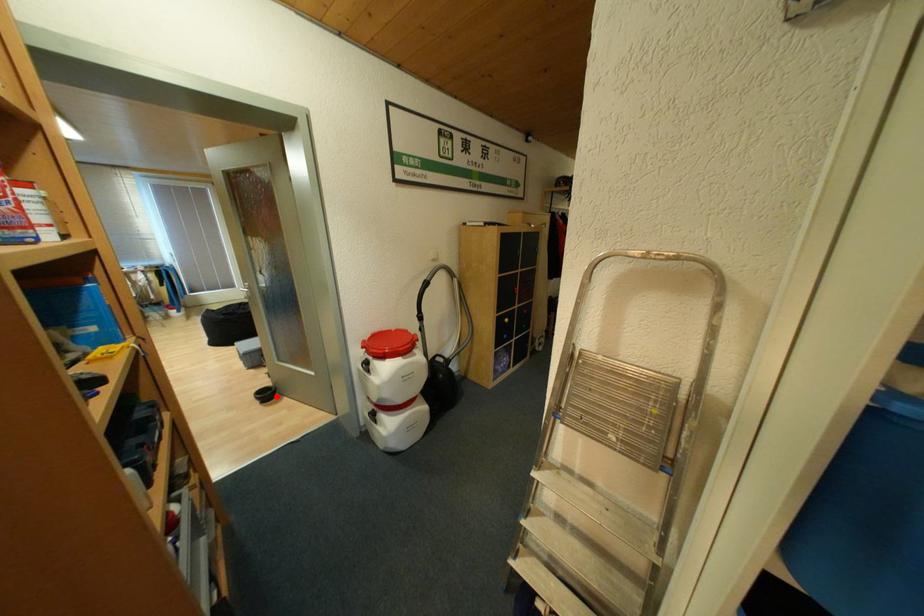
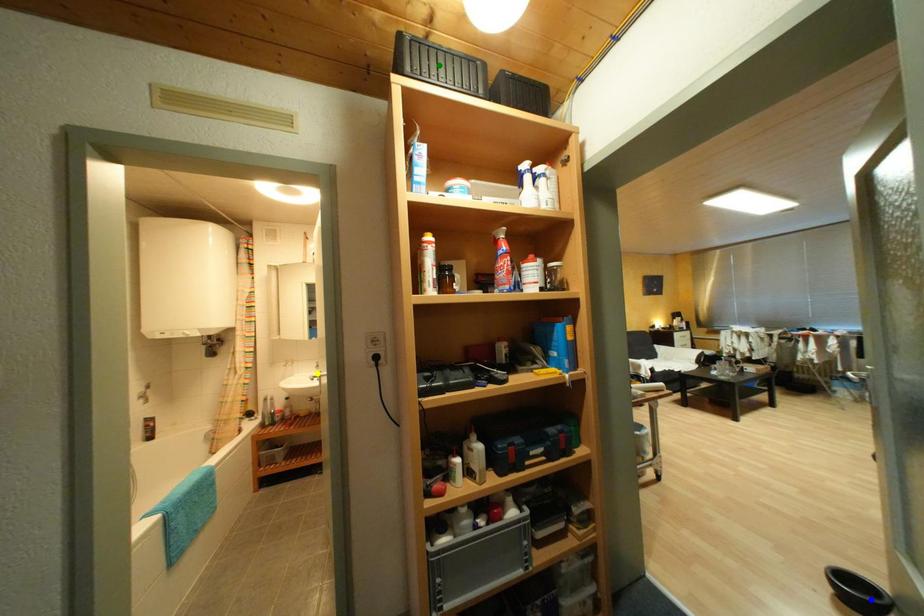
Question: I am providing you with two images of the same scene from different viewpoints. A red point is marked on the first image. You are given multiple points on the second image. Which mark in image 2 goes with the point in image 1?

Choices:
 (A) green point
 (B) blue point
 (C) yellow point

Answer: (B)